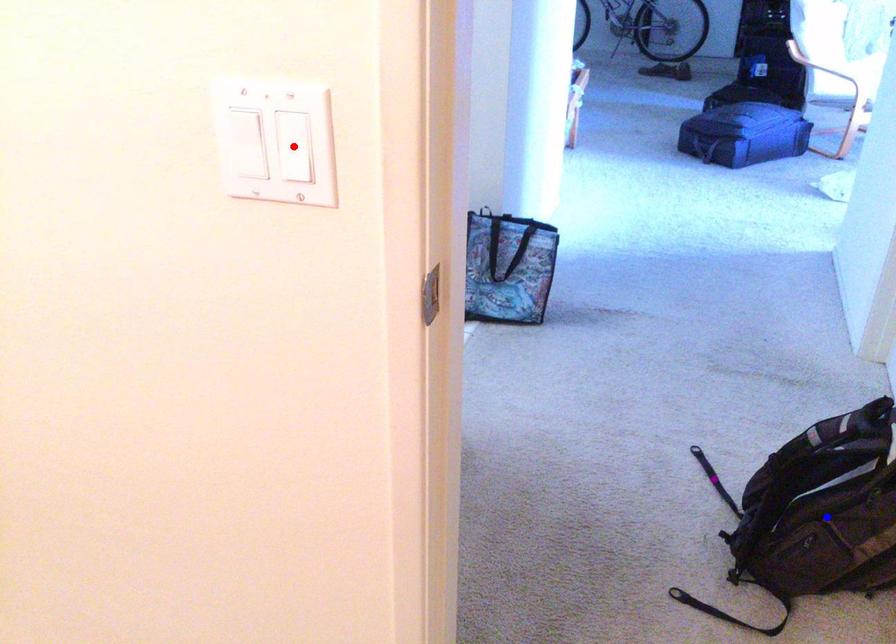
Order these from nearest to farthest:
red point | purple point | blue point

purple point < blue point < red point